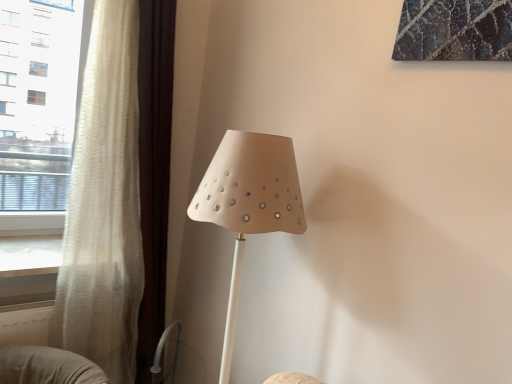
Question: Is white sheer curtain at left at the back of matte beige lampshade at center?

Choices:
 (A) yes
 (B) no

Answer: (B)

Question: Can you confirm if matte beige lampshade at center is bigger than white sheer curtain at left?

Choices:
 (A) yes
 (B) no

Answer: (A)

Question: Can you confirm if matte beige lampshade at center is positioned to the right of white sheer curtain at left?

Choices:
 (A) no
 (B) yes

Answer: (B)

Question: From the image's perspective, does matte beige lampshade at center appear lower than white sheer curtain at left?

Choices:
 (A) no
 (B) yes

Answer: (B)

Question: Would you say matte beige lampshade at center contains white sheer curtain at left?

Choices:
 (A) no
 (B) yes

Answer: (A)

Question: Is point (19, 109) positioned closer to the camera than point (270, 193)?

Choices:
 (A) farther
 (B) closer

Answer: (A)

Question: From the image's perspective, is white sheer curtain at left located above or below matte beige lampshade at center?

Choices:
 (A) above
 (B) below

Answer: (A)

Question: Looking at the image, does white sheer curtain at left seem bigger or smaller compared to matte beige lampshade at center?

Choices:
 (A) small
 (B) big

Answer: (A)

Question: In the image, is white sheer curtain at left on the left side or the right side of matte beige lampshade at center?

Choices:
 (A) left
 (B) right

Answer: (A)

Question: Considering the positions of point (270, 135) and point (16, 273), is point (270, 135) closer or farther from the camera than point (16, 273)?

Choices:
 (A) closer
 (B) farther

Answer: (A)

Question: From the image's perspective, relative to white sheer curtain at left, is matte beige lampshade at center above or below?

Choices:
 (A) above
 (B) below

Answer: (B)

Question: In the image, is matte beige lampshade at center positioned in front of or behind white sheer curtain at left?

Choices:
 (A) behind
 (B) front

Answer: (B)

Question: Would you say matte beige lampshade at center is inside or outside white sheer curtain at left?

Choices:
 (A) outside
 (B) inside

Answer: (A)

Question: Considering the positions of white textured curtain at left and matte beige lampshade at center in the image, is white textured curtain at left wider or thinner than matte beige lampshade at center?

Choices:
 (A) thin
 (B) wide

Answer: (A)

Question: Considering the positions of white textured curtain at left and matte beige lampshade at center in the image, is white textured curtain at left taller or shorter than matte beige lampshade at center?

Choices:
 (A) short
 (B) tall

Answer: (B)